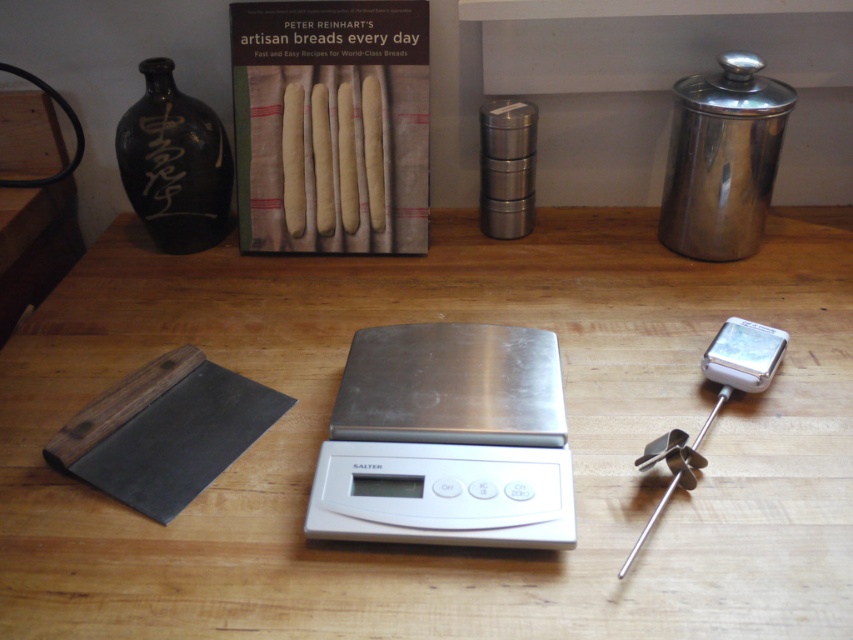
Does wooden table at center have a smaller size compared to silver metallic thermometer at right?

No, wooden table at center is not smaller than silver metallic thermometer at right.

Who is shorter, wooden table at center or silver metallic thermometer at right?

Standing shorter between the two is silver metallic thermometer at right.

Which is behind, point (105, 556) or point (746, 344)?

The point (746, 344) is more distant.

This screenshot has width=853, height=640. Identify the location of wooden table at center. (450, 547).

Is matte paper book at center to the right of silver metallic thermometer at right from the viewer's perspective?

Incorrect, matte paper book at center is not on the right side of silver metallic thermometer at right.

Consider the image. Does matte paper book at center come behind silver metallic thermometer at right?

Yes.

Is point (393, 156) less distant than point (692, 467)?

No.

Where is `matte paper book at center`? The image size is (853, 640). matte paper book at center is located at coordinates (331, 125).

Is silver/stainless steel scale at center smaller than matte paper book at center?

Actually, silver/stainless steel scale at center might be larger than matte paper book at center.

Based on the photo, is silver/stainless steel scale at center thinner than matte paper book at center?

Yes, silver/stainless steel scale at center is thinner than matte paper book at center.

The width and height of the screenshot is (853, 640). What do you see at coordinates (448, 440) in the screenshot?
I see `silver/stainless steel scale at center` at bounding box center [448, 440].

Identify the location of silver/stainless steel scale at center. (448, 440).